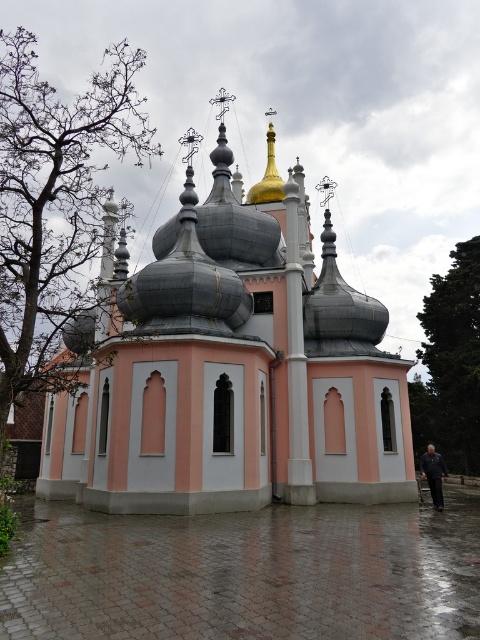
Question: Which of the following is the farthest from the observer?

Choices:
 (A) (436, 461)
 (B) (274, 186)

Answer: (B)

Question: Observing the image, what is the correct spatial positioning of pink matte church at center in reference to dark blue fabric at lower right?

Choices:
 (A) below
 (B) above

Answer: (B)

Question: Which point is farther to the camera?

Choices:
 (A) pink matte church at center
 (B) gold polished dome at center
 (C) dark blue fabric at lower right

Answer: (B)

Question: Which point is farther to the camera?

Choices:
 (A) pink matte church at center
 (B) dark blue fabric at lower right

Answer: (B)

Question: In this image, where is pink matte church at center located relative to dark blue fabric at lower right?

Choices:
 (A) left
 (B) right

Answer: (A)

Question: Is pink matte church at center positioned before gold polished dome at center?

Choices:
 (A) yes
 (B) no

Answer: (A)